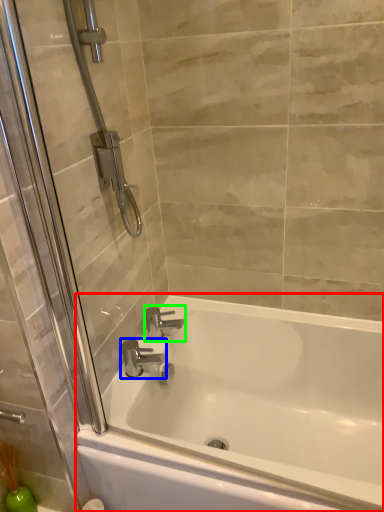
Question: Based on their relative distances, which object is nearer to bathtub (highlighted by a red box)? Choose from tap (highlighted by a blue box) and tap (highlighted by a green box).

Choices:
 (A) tap
 (B) tap

Answer: (A)